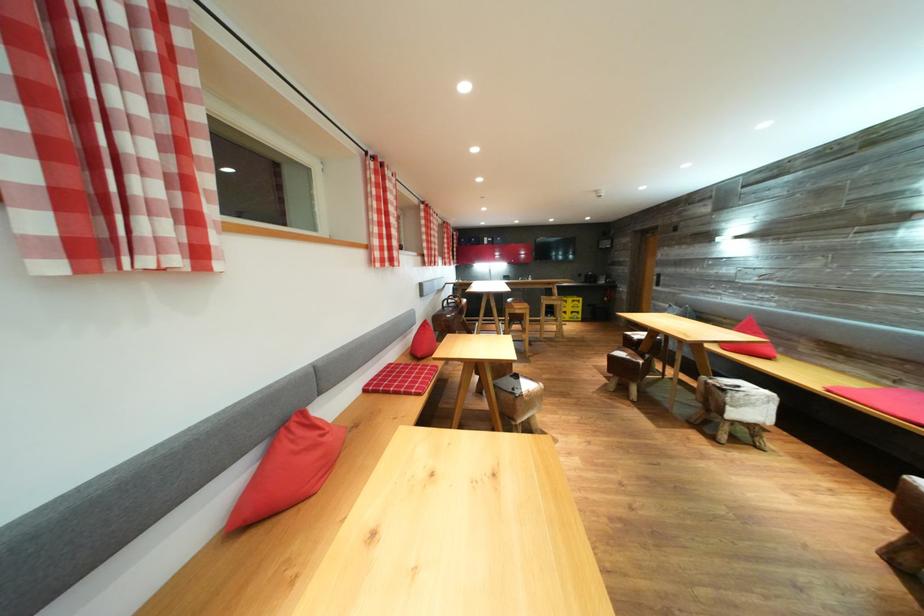
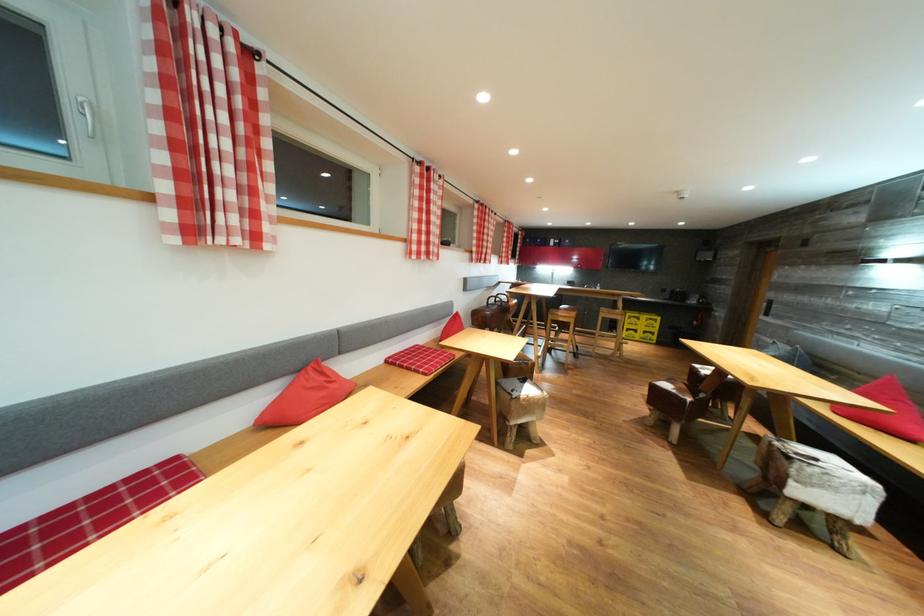
Find the pixel in the second image that matches (638,358) in the first image.

(689, 392)